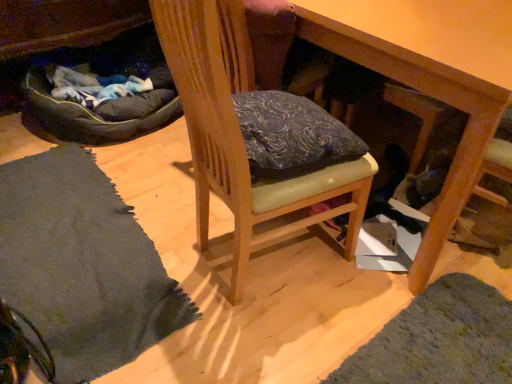
The image size is (512, 384). I want to click on vacant space in between soft gray rug at lower left and wooden chair at center, so click(199, 329).